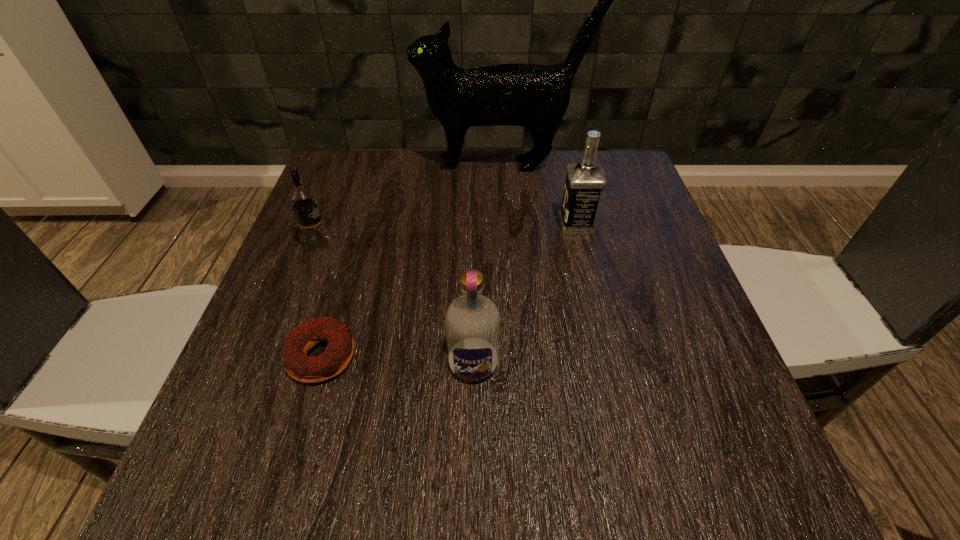
At what (x,y) coordinates should I click in order to perform the action: click on object that stands as the third closest to the third farthest object. Please return your answer as a coordinate pair (x, y). This screenshot has width=960, height=540. Looking at the image, I should click on (472, 320).

Image resolution: width=960 pixels, height=540 pixels. I want to click on the closest vodka relative to the cat, so click(x=585, y=181).

Choose which vodka is the second nearest neighbor to the second farthest object. Please provide its 2D coordinates. Your answer should be formatted as a tuple, i.e. [(x, y)], where the tuple contains the x and y coordinates of a point satisfying the conditions above.

[(303, 201)]

The width and height of the screenshot is (960, 540). I want to click on blank space that satisfies the following two spatial constraints: 1. on the front label of the farthest vodka; 2. on the label of the nearest vodka, so click(x=610, y=363).

Identify the location of vacant space that satisfies the following two spatial constraints: 1. on the front label of the fourth nearest object; 2. on the front side of the doughnut. The height and width of the screenshot is (540, 960). (608, 356).

At what (x,y) coordinates should I click in order to perform the action: click on free space that satisfies the following two spatial constraints: 1. on the label of the shortest object; 2. on the right side of the leftmost vodka. Please return your answer as a coordinate pair (x, y). This screenshot has width=960, height=540. Looking at the image, I should click on (276, 356).